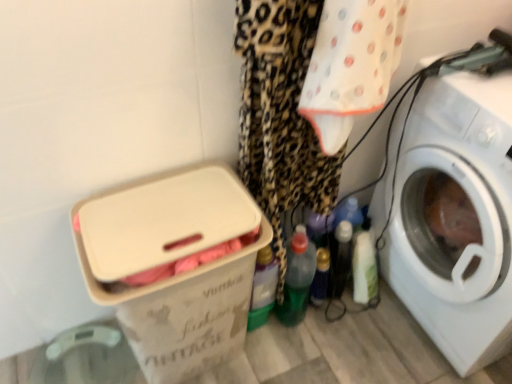
Question: Is white plastic box at lower left in front of white plastic washing machine at right?

Choices:
 (A) no
 (B) yes

Answer: (A)

Question: Is white plastic box at lower left shorter than white plastic washing machine at right?

Choices:
 (A) yes
 (B) no

Answer: (A)

Question: From the image's perspective, does white plastic box at lower left appear lower than white plastic washing machine at right?

Choices:
 (A) yes
 (B) no

Answer: (A)

Question: Is white plastic box at lower left in contact with white plastic washing machine at right?

Choices:
 (A) no
 (B) yes

Answer: (A)

Question: Are white plastic box at lower left and white plastic washing machine at right far apart?

Choices:
 (A) no
 (B) yes

Answer: (A)

Question: Does point (180, 365) appear closer or farther from the camera than point (286, 276)?

Choices:
 (A) closer
 (B) farther

Answer: (A)

Question: From their relative heights in the image, would you say white plastic box at lower left is taller or shorter than green plastic bottle at center, arranged as the 2th bottle when viewed from the left?

Choices:
 (A) short
 (B) tall

Answer: (B)

Question: Based on their positions, is white plastic box at lower left located to the left or right of green plastic bottle at center, arranged as the 2th bottle when viewed from the left?

Choices:
 (A) left
 (B) right

Answer: (A)

Question: Which is correct: white plastic box at lower left is inside green plastic bottle at center, arranged as the 2th bottle when viewed from the left, or outside of it?

Choices:
 (A) outside
 (B) inside

Answer: (A)

Question: In the image, is white plastic box at lower left positioned in front of or behind translucent plastic bottle at center, the third bottle viewed from the left?

Choices:
 (A) front
 (B) behind

Answer: (A)

Question: Would you say white plastic box at lower left is to the left or to the right of translucent plastic bottle at center, the third bottle viewed from the left, in the picture?

Choices:
 (A) left
 (B) right

Answer: (A)

Question: From the image's perspective, is white plastic box at lower left positioned above or below translucent plastic bottle at center, which is the 1th bottle in right-to-left order?

Choices:
 (A) below
 (B) above

Answer: (B)

Question: Is point (223, 178) positioned closer to the camera than point (320, 289)?

Choices:
 (A) closer
 (B) farther

Answer: (A)

Question: In terms of width, does translucent plastic bottle at center, the third bottle viewed from the left, look wider or thinner when compared to green plastic bottle at center, which is counted as the second bottle, starting from the right?

Choices:
 (A) thin
 (B) wide

Answer: (A)

Question: From the image's perspective, relative to green plastic bottle at center, which is counted as the second bottle, starting from the right, is translucent plastic bottle at center, the third bottle viewed from the left, above or below?

Choices:
 (A) below
 (B) above

Answer: (A)